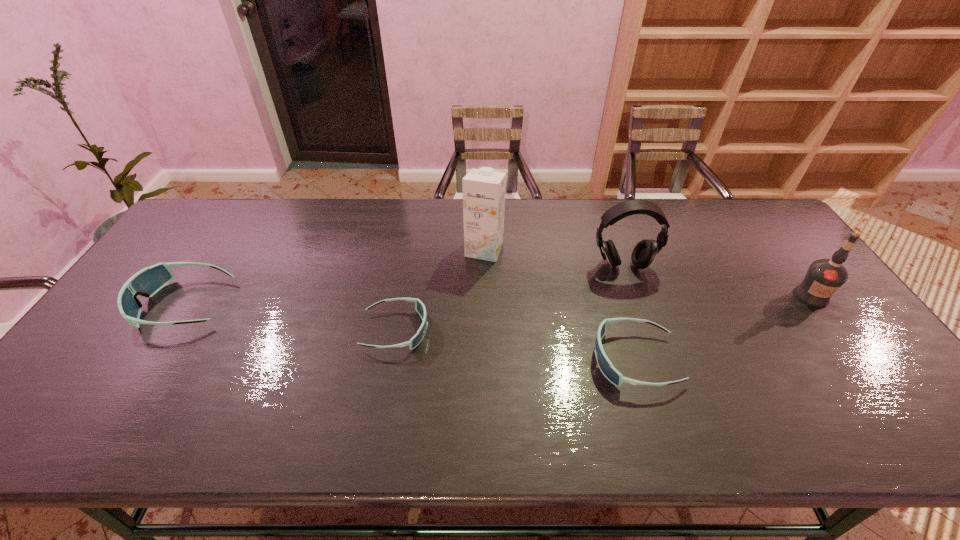
Locate an element on the screen. the leftmost goggles is located at coordinates (147, 282).

The width and height of the screenshot is (960, 540). I want to click on the second object from left to right, so click(x=419, y=306).

At what (x,y) coordinates should I click in order to perform the action: click on the shortest goggles. Please return your answer as a coordinate pair (x, y). This screenshot has width=960, height=540. Looking at the image, I should click on (419, 306).

In order to click on the fifth tallest object in this screenshot , I will do `click(609, 371)`.

Locate an element on the screen. the second tallest goggles is located at coordinates 609,371.

The height and width of the screenshot is (540, 960). What are the coordinates of `the rightmost object` in the screenshot? It's located at click(x=824, y=277).

Find the location of `the tallest object`. the tallest object is located at coordinates (484, 189).

Identify the location of the third object from left to right. (484, 189).

The width and height of the screenshot is (960, 540). In order to click on earphone in this screenshot , I will do coord(644,253).

Locate an element on the screen. free space located 0.070m on the front-facing side of the second object from left to right is located at coordinates (455, 330).